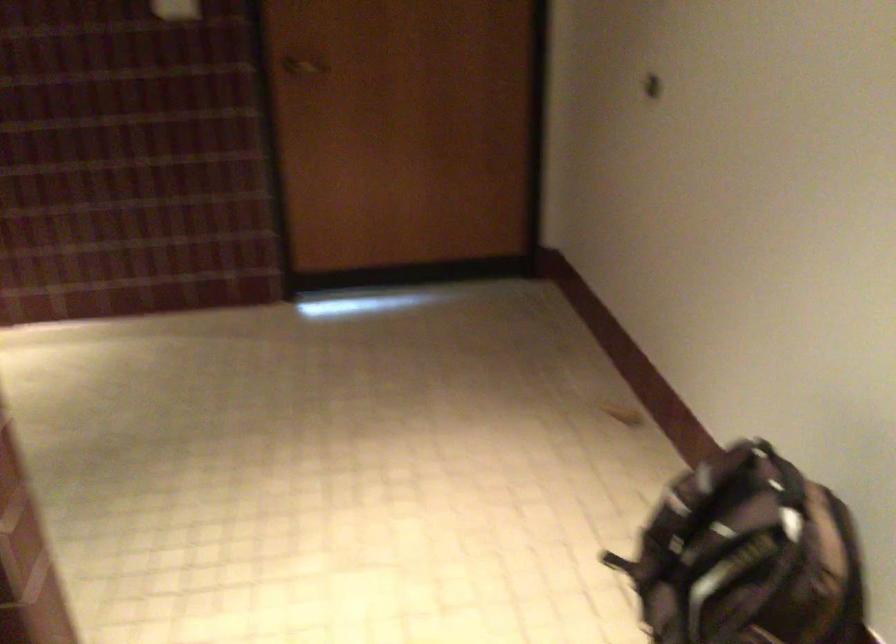
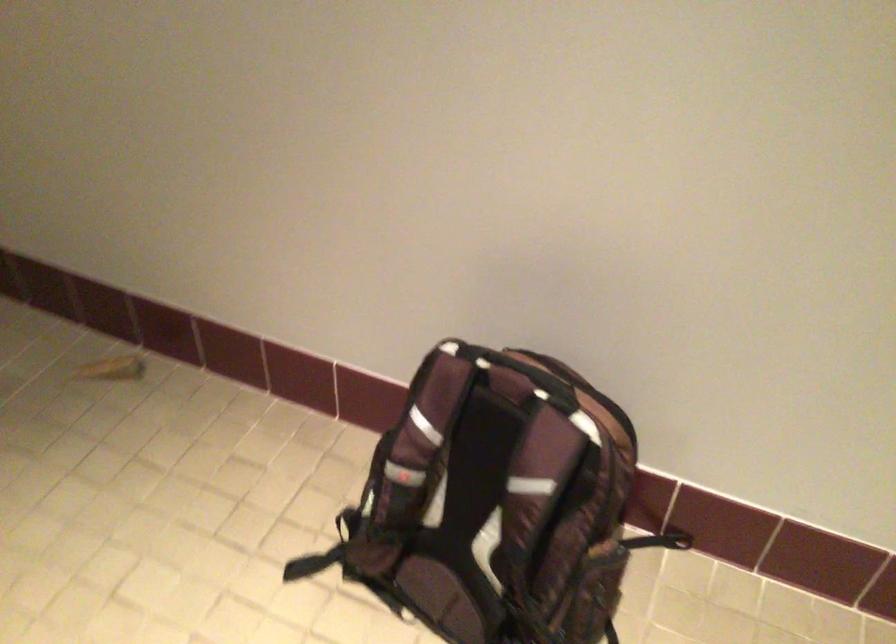
The images are taken continuously from a first-person perspective. In which direction is your viewpoint rotating?

The rotation direction of the camera is right-down.